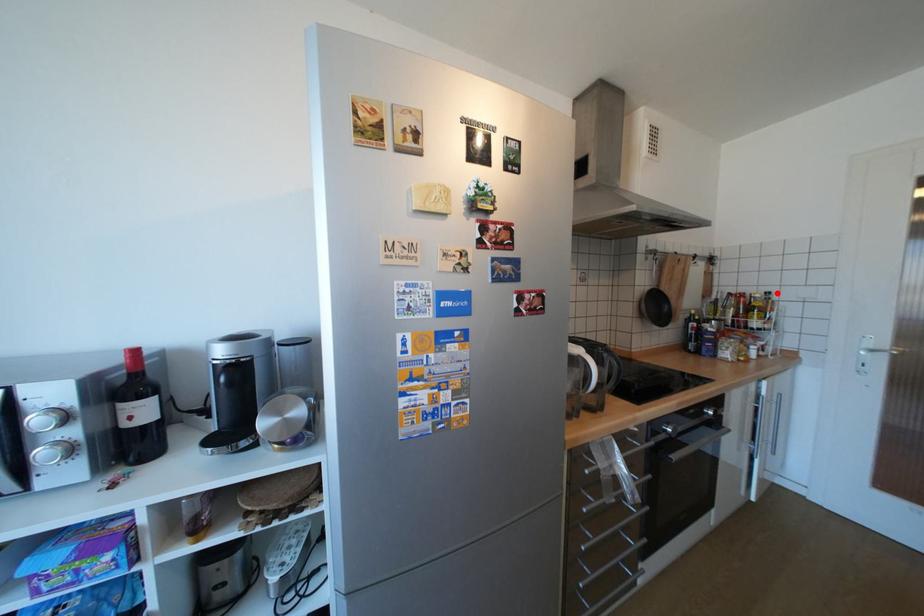
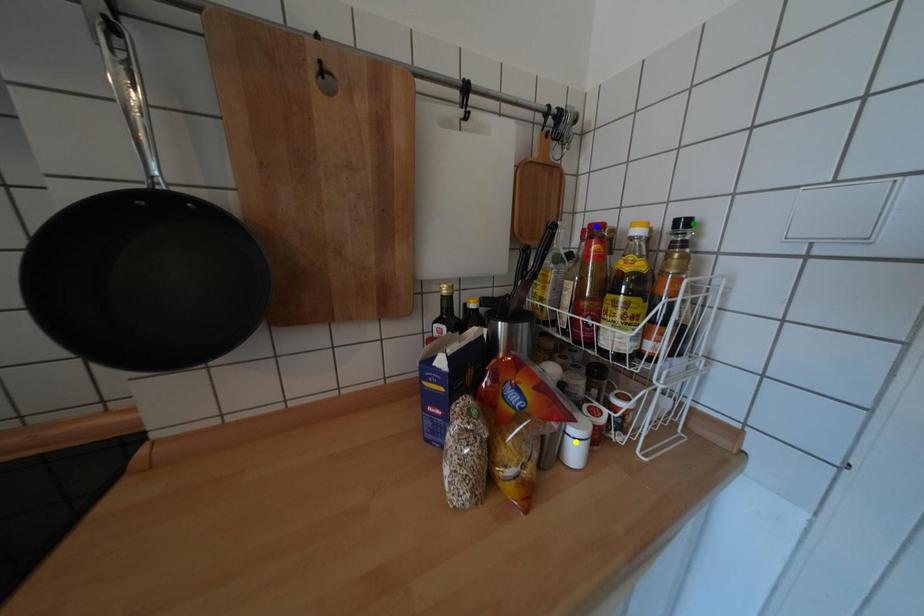
Question: I am providing you with two images of the same scene from different viewpoints. A red point is marked on the first image. You are given multiple points on the second image. Which mark in image 2 goes with the point in image 1?

Choices:
 (A) yellow point
 (B) blue point
 (C) green point

Answer: (C)